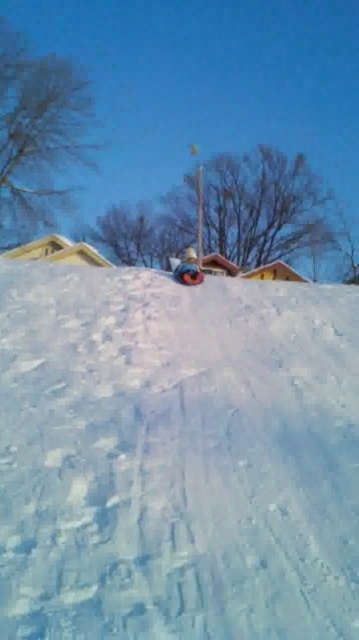
Can you confirm if white powdery snow at center is positioned to the right of matte blue snowboard at center?

Yes, white powdery snow at center is to the right of matte blue snowboard at center.

Who is more forward, [131,536] or [179,262]?

Positioned in front is point [131,536].

This screenshot has height=640, width=359. Find the location of `white powdery snow at center`. white powdery snow at center is located at coordinates (176, 456).

Find the location of `white powdery snow at center`. white powdery snow at center is located at coordinates (176, 456).